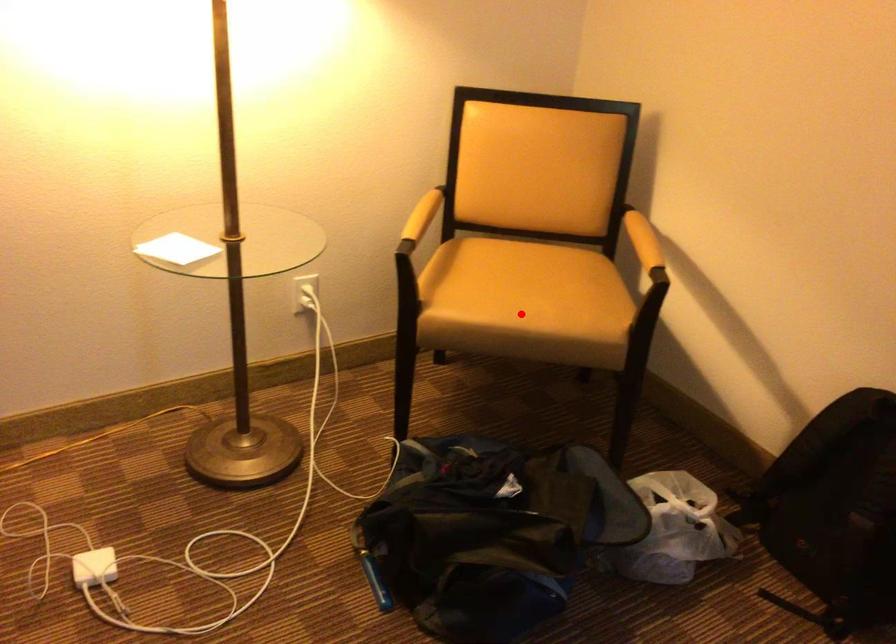
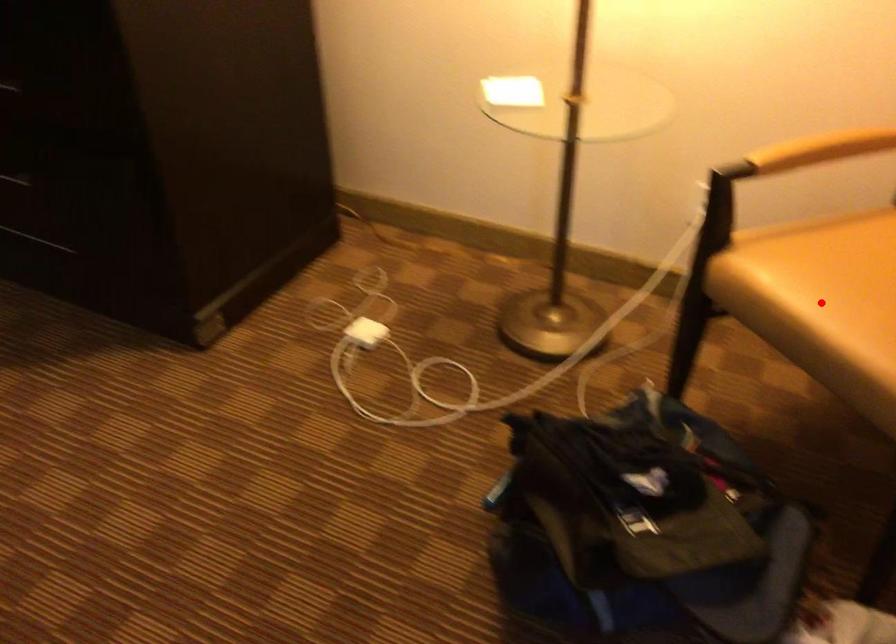
I am providing you with two images of the same scene from different viewpoints. A red point is marked on the first image and another point is marked on the second image. Are the points marked in image1 and image2 representing the same 3D position?

Yes